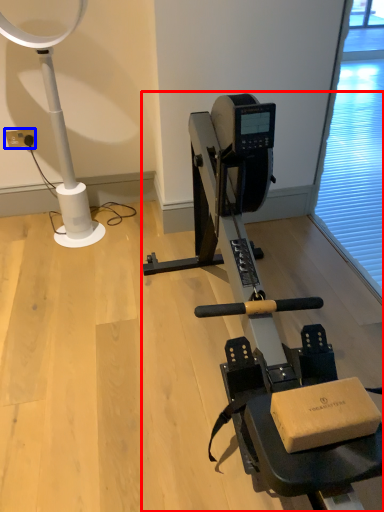
Question: Among these objects, which one is farthest to the camera, stationary bicycle (highlighted by a red box) or electric outlet (highlighted by a blue box)?

Choices:
 (A) stationary bicycle
 (B) electric outlet

Answer: (B)